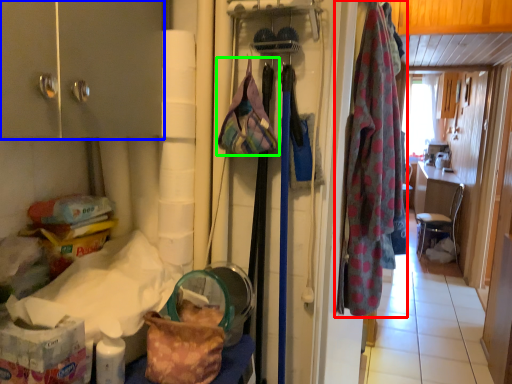
Question: Estimate the real-world distances between objects in this image. Which object is closer to clothing (highlighted by a red box), cabinetry (highlighted by a blue box) or handbag (highlighted by a green box)?

Choices:
 (A) cabinetry
 (B) handbag

Answer: (B)